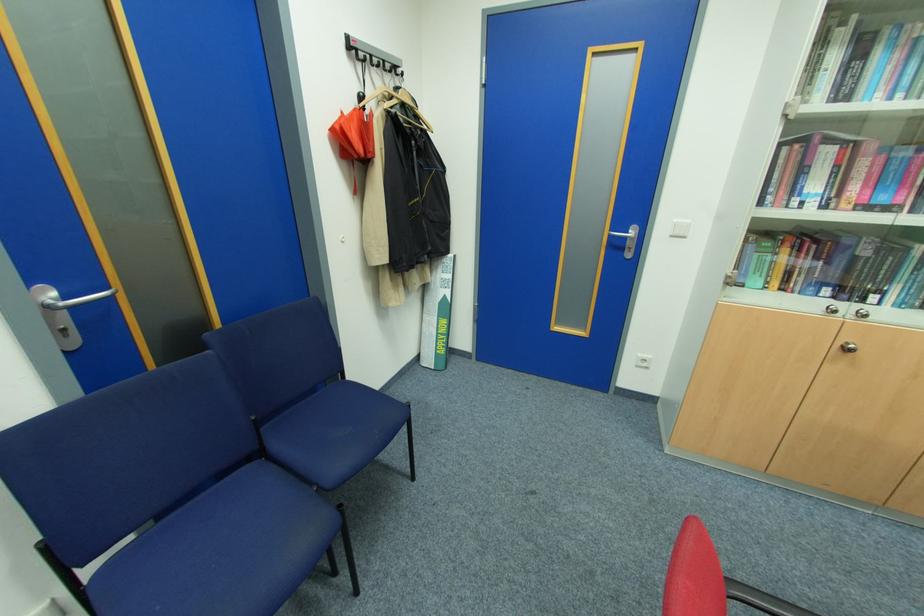
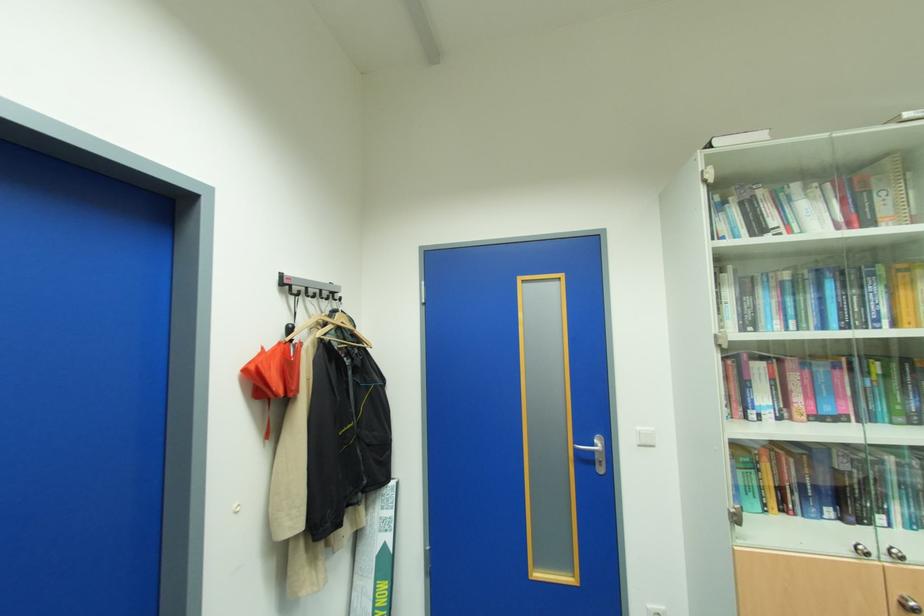
Question: Which direction would the cameraman need to move to produce the second image? Reply with the corresponding letter.

Choices:
 (A) Left
 (B) Right
 (C) Forward
 (D) Backward

Answer: (C)